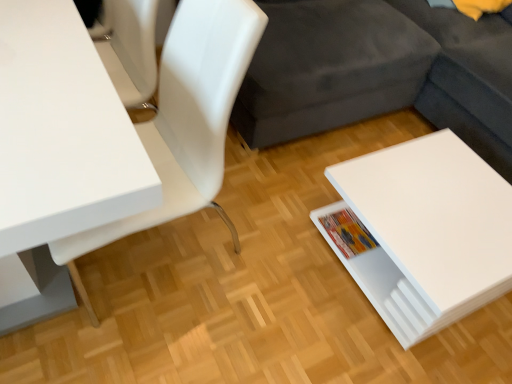
Locate an element on the screen. The image size is (512, 384). free area in between white glossy table at lower right, the first table from the right, and white glossy chair at upper left is located at coordinates (274, 273).